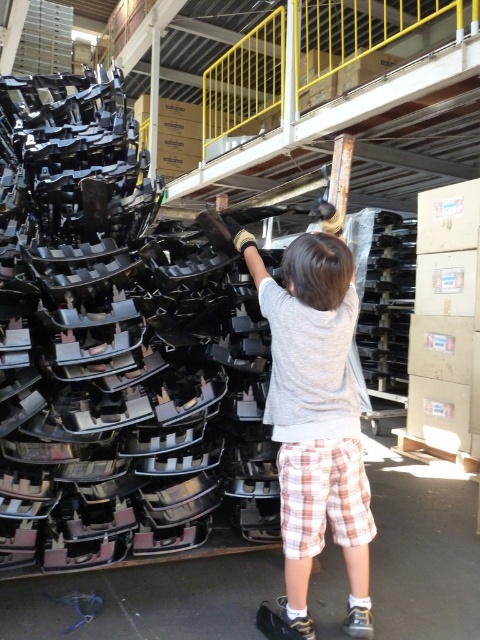
Is matte black shoe at center shorter than white fabric shoe at lower center?

Incorrect, matte black shoe at center's height does not fall short of white fabric shoe at lower center's.

Between point (207, 236) and point (279, 605), which one is positioned behind?

The point (207, 236) is more distant.

Find the location of a particular element. This screenshot has height=640, width=480. matte black shoe at center is located at coordinates pos(216,230).

From the picture: Does matte black shoe at center appear over white textured shoe at lower center?

Yes, matte black shoe at center is above white textured shoe at lower center.

Does matte black shoe at center have a greater height compared to white textured shoe at lower center?

A: Correct, matte black shoe at center is much taller as white textured shoe at lower center.

Which is in front, point (227, 237) or point (360, 627)?

Point (360, 627) is in front.

Find the location of a particular element. The width and height of the screenshot is (480, 640). matte black shoe at center is located at coordinates click(216, 230).

Is white fabric shoe at lower center to the left of white textured shoe at lower center from the viewer's perspective?

Correct, you'll find white fabric shoe at lower center to the left of white textured shoe at lower center.

Is white fabric shoe at lower center behind white textured shoe at lower center?

That is False.

Does point (287, 621) come farther from viewer compared to point (368, 627)?

No, it is not.

Identify the location of white fabric shoe at lower center. (294, 621).